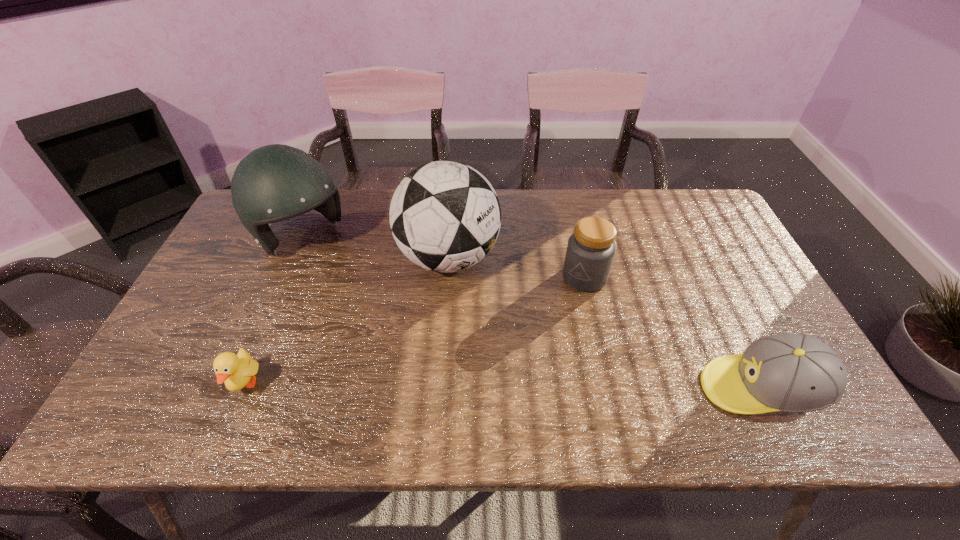
The image size is (960, 540). What are the coordinates of `duckling` in the screenshot? It's located at (237, 371).

The image size is (960, 540). What are the coordinates of `baseball cap` in the screenshot? It's located at (788, 372).

The width and height of the screenshot is (960, 540). Find the location of `the second shortest object`. the second shortest object is located at coordinates (788, 372).

Where is `football helmet`? The height and width of the screenshot is (540, 960). football helmet is located at coordinates (276, 182).

Locate an element on the screen. This screenshot has width=960, height=540. the fourth object from left to right is located at coordinates (591, 249).

I want to click on the third shortest object, so click(591, 249).

Where is `soccer ball`? The image size is (960, 540). soccer ball is located at coordinates (445, 216).

Locate an element on the screen. This screenshot has width=960, height=540. vacant space located 0.320m on the front-facing side of the baseball cap is located at coordinates (562, 389).

Find the location of `vacant space located 0.220m on the front-facing side of the baseball cap`. vacant space located 0.220m on the front-facing side of the baseball cap is located at coordinates (605, 389).

This screenshot has width=960, height=540. Find the location of `free space located 0.120m on the front-facing side of the baseball cap`. free space located 0.120m on the front-facing side of the baseball cap is located at coordinates (649, 389).